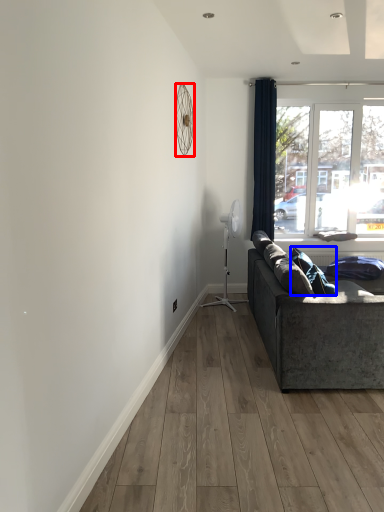
Question: Which object is further to the camera taking this photo, mechanical fan (highlighted by a red box) or pillow (highlighted by a blue box)?

Choices:
 (A) mechanical fan
 (B) pillow

Answer: (B)